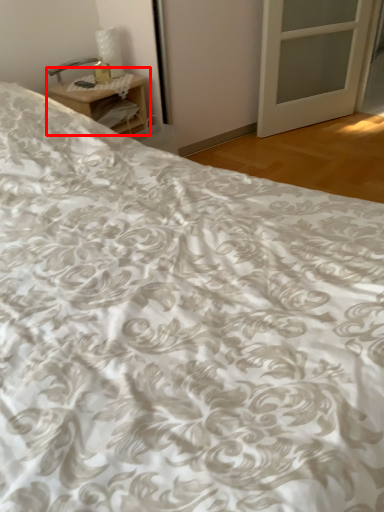
Question: In this image, where is nightstand (annotated by the red box) located relative to table lamp?

Choices:
 (A) left
 (B) right

Answer: (B)